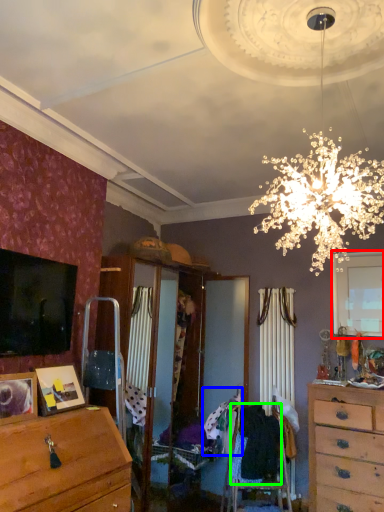
Question: Which object is the farthest from window (highlighted by a red box)? Choose among these: clothing (highlighted by a blue box) or clothing (highlighted by a green box).

Choices:
 (A) clothing
 (B) clothing

Answer: (A)